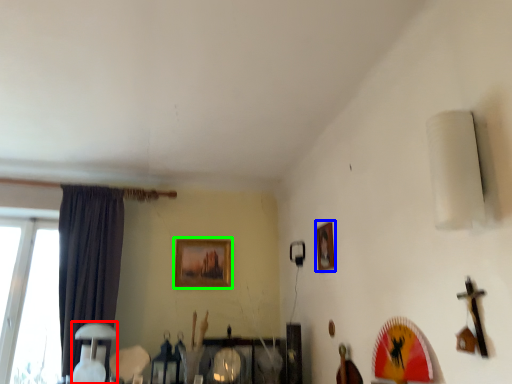
Question: Which is farther away from table lamp (highlighted by a red box)? picture frame (highlighted by a blue box) or picture frame (highlighted by a green box)?

Choices:
 (A) picture frame
 (B) picture frame

Answer: (A)